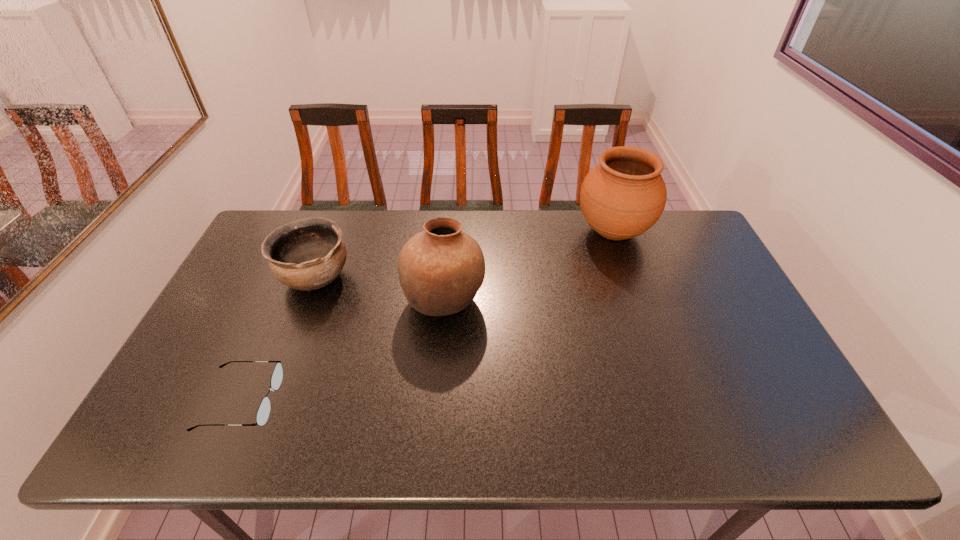
In the image, there is a desktop. Where is `free space at the far right corner`? The image size is (960, 540). free space at the far right corner is located at coordinates (694, 221).

What are the coordinates of `unoccupied area between the second object from right to left and the shortest object` in the screenshot? It's located at (343, 350).

This screenshot has width=960, height=540. Identify the location of empty location between the third object from left to right and the shortest pottery. (380, 288).

Find the location of a particular element. This screenshot has height=540, width=960. free space between the spectacles and the second pottery from right to left is located at coordinates (343, 350).

Where is `vacant space that's between the third object from left to right and the shortest object`? The width and height of the screenshot is (960, 540). vacant space that's between the third object from left to right and the shortest object is located at coordinates (343, 350).

Where is `free spot between the rightmost pottery and the second pottery from left to right`? The height and width of the screenshot is (540, 960). free spot between the rightmost pottery and the second pottery from left to right is located at coordinates (529, 266).

Choose which object is the third nearest neighbor to the spectacles. Please provide its 2D coordinates. Your answer should be formatted as a tuple, i.e. [(x, y)], where the tuple contains the x and y coordinates of a point satisfying the conditions above.

[(623, 196)]

This screenshot has width=960, height=540. Identify the location of object that stands as the closest to the nearest object. (307, 254).

Locate which pottery is the second closest to the leftmost pottery. Please provide its 2D coordinates. Your answer should be formatted as a tuple, i.e. [(x, y)], where the tuple contains the x and y coordinates of a point satisfying the conditions above.

[(623, 196)]

Locate which pottery is the second closest to the second object from right to left. Please provide its 2D coordinates. Your answer should be formatted as a tuple, i.e. [(x, y)], where the tuple contains the x and y coordinates of a point satisfying the conditions above.

[(623, 196)]